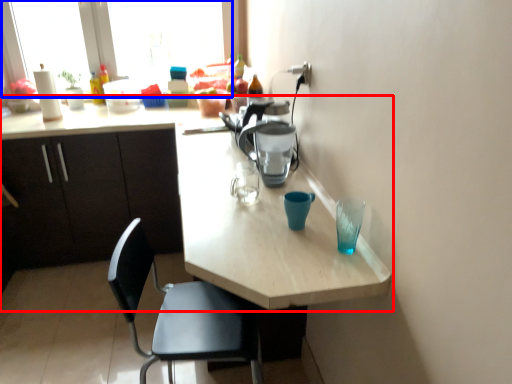
Question: Which point is further to the camera, kitchen & dining room table (highlighted by a red box) or window screen (highlighted by a blue box)?

Choices:
 (A) kitchen & dining room table
 (B) window screen

Answer: (B)